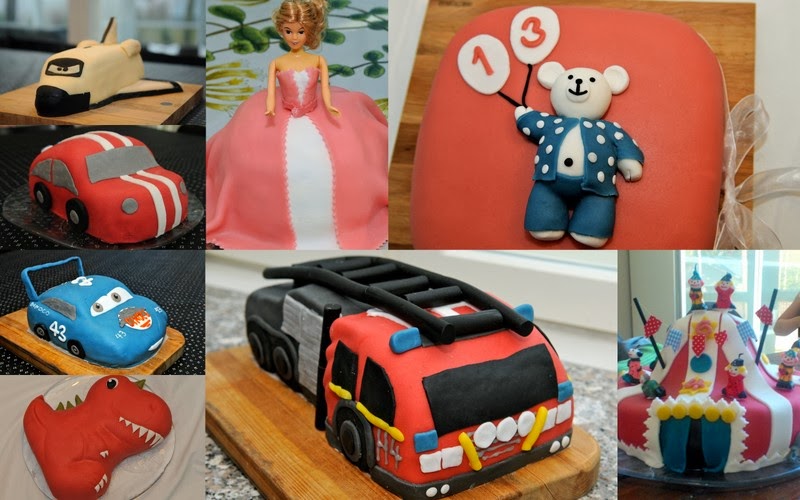
Find the location of a particular element. Image resolution: width=800 pixels, height=500 pixels. white plates is located at coordinates [x=29, y=458].